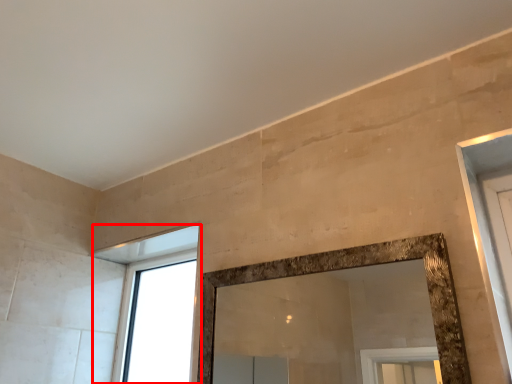
Question: Considering the relative positions of window (annotated by the red box) and backdrop in the image provided, where is window (annotated by the red box) located with respect to the staircase?

Choices:
 (A) left
 (B) right

Answer: (A)